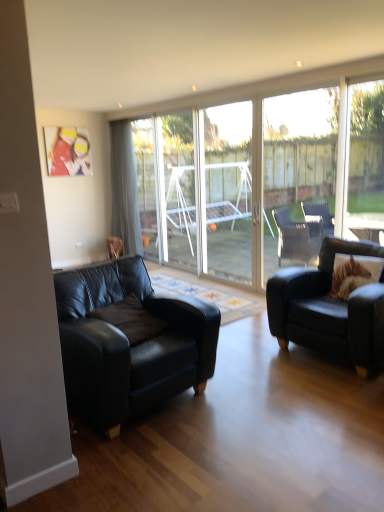
Question: Is gray fabric curtain at left in front of or behind transparent glass screen door at center in the image?

Choices:
 (A) front
 (B) behind

Answer: (B)

Question: Which is correct: gray fabric curtain at left is inside transparent glass screen door at center, or outside of it?

Choices:
 (A) inside
 (B) outside

Answer: (B)

Question: Considering the real-world distances, which object is closest to the transparent glass window at center, which is counted as the 2th window, starting from the front?

Choices:
 (A) matte black armchair at right, which ranks as the 2th studio couch in left-to-right order
 (B) transparent glass door at center, the second window when ordered from back to front
 (C) transparent glass door at center
 (D) transparent glass screen door at center
 (E) gray fabric curtain at left

Answer: (E)

Question: Estimate the real-world distances between objects in this image. Which object is closer to the brown textured pillow at right?

Choices:
 (A) transparent glass window at center, arranged as the first window when viewed from the back
 (B) gray fabric curtain at left
 (C) transparent glass screen door at center
 (D) transparent glass door at center
 (E) transparent glass door at center, the 1th window positioned from the front

Answer: (E)